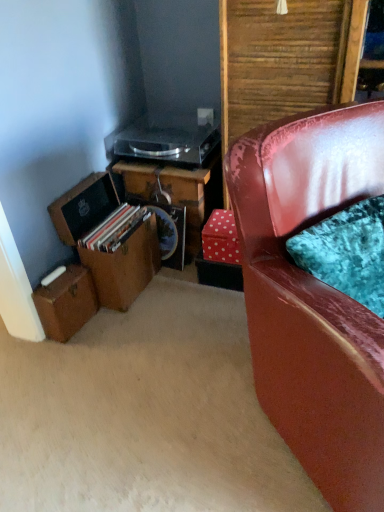
Question: From the image's perspective, is wooden desk at center over transparent plastic record player at upper center?

Choices:
 (A) yes
 (B) no

Answer: (B)

Question: Is wooden desk at center outside transparent plastic record player at upper center?

Choices:
 (A) yes
 (B) no

Answer: (A)

Question: From the image's perspective, would you say wooden desk at center is shown under transparent plastic record player at upper center?

Choices:
 (A) yes
 (B) no

Answer: (A)

Question: Does wooden desk at center have a greater height compared to transparent plastic record player at upper center?

Choices:
 (A) no
 (B) yes

Answer: (B)

Question: Can you confirm if wooden desk at center is bigger than transparent plastic record player at upper center?

Choices:
 (A) no
 (B) yes

Answer: (B)

Question: Would you consider wooden desk at center to be distant from transparent plastic record player at upper center?

Choices:
 (A) yes
 (B) no

Answer: (B)

Question: Does shiny red leather chair at right touch transparent plastic record player at upper center?

Choices:
 (A) no
 (B) yes

Answer: (A)

Question: Could you tell me if shiny red leather chair at right is facing transparent plastic record player at upper center?

Choices:
 (A) no
 (B) yes

Answer: (A)

Question: Is shiny red leather chair at right further to camera compared to transparent plastic record player at upper center?

Choices:
 (A) yes
 (B) no

Answer: (B)

Question: Does shiny red leather chair at right have a lesser height compared to transparent plastic record player at upper center?

Choices:
 (A) yes
 (B) no

Answer: (B)

Question: Can you confirm if shiny red leather chair at right is smaller than transparent plastic record player at upper center?

Choices:
 (A) yes
 (B) no

Answer: (B)

Question: Is shiny red leather chair at right closer to camera compared to transparent plastic record player at upper center?

Choices:
 (A) yes
 (B) no

Answer: (A)

Question: Could you tell me if shiny red leather chair at right is facing red polka dot cardboard box at lower right?

Choices:
 (A) no
 (B) yes

Answer: (A)